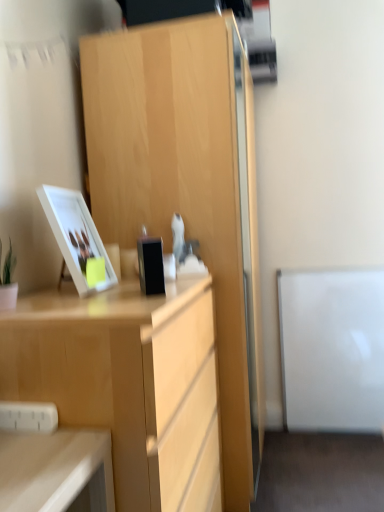
Where is `vacant area that is in front of white glossy picture frame at upper left`? vacant area that is in front of white glossy picture frame at upper left is located at coordinates (70, 298).